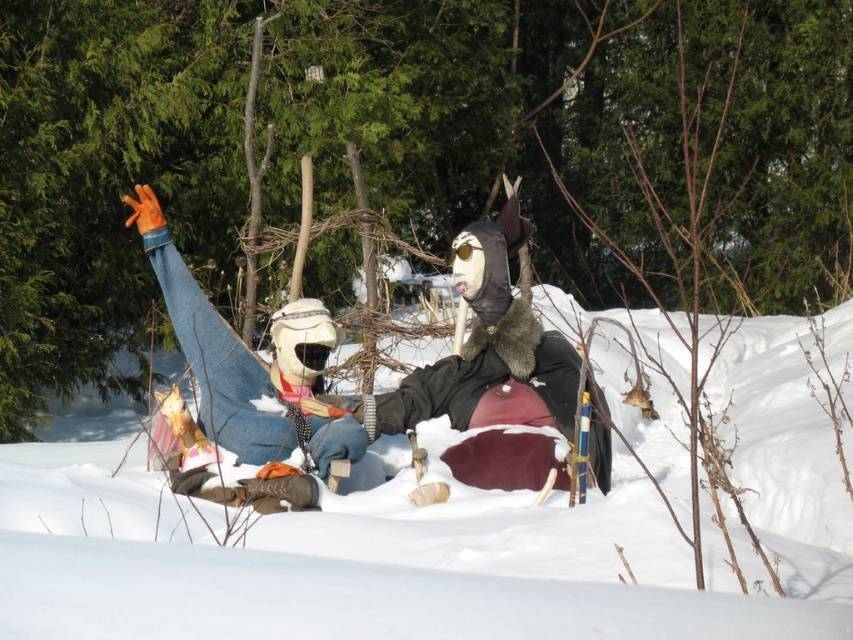
Which is more to the left, white fluffy snow at center or denim jeans at left?

denim jeans at left

The height and width of the screenshot is (640, 853). Describe the element at coordinates (437, 540) in the screenshot. I see `white fluffy snow at center` at that location.

This screenshot has width=853, height=640. What are the coordinates of `white fluffy snow at center` in the screenshot? It's located at (437, 540).